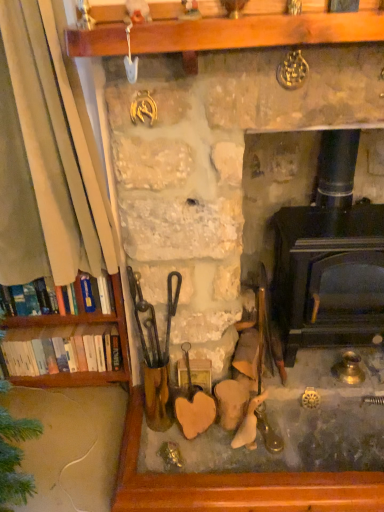
Locate an element on the screen. The height and width of the screenshot is (512, 384). vacant region below white paperbacks at left, the 1th book from the bottom (from a real-world perspective) is located at coordinates (83, 394).